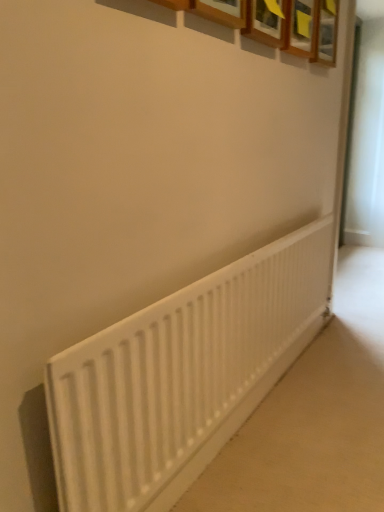
Find the location of a particular element. wooden picture frame at upper center, the second picture frame in the front-to-back sequence is located at coordinates (x=326, y=33).

The image size is (384, 512). Find the location of `wooden picture frame at upper center, the second picture frame in the front-to-back sequence`. wooden picture frame at upper center, the second picture frame in the front-to-back sequence is located at coordinates (326, 33).

Is white matte radiator at lower center not inside wooden picture frame at upper center, the 2th picture frame when ordered from left to right?

Indeed, white matte radiator at lower center is completely outside wooden picture frame at upper center, the 2th picture frame when ordered from left to right.

Does white matte radiator at lower center have a lesser height compared to wooden picture frame at upper center, the 2th picture frame when ordered from left to right?

In fact, white matte radiator at lower center may be taller than wooden picture frame at upper center, the 2th picture frame when ordered from left to right.

Considering the points (195, 438) and (334, 10), which point is in front, point (195, 438) or point (334, 10)?

The point (195, 438) is closer.

Is white matte radiator at lower center turned away from wooden picture frame at upper center, which is the first picture frame from right to left?

No, white matte radiator at lower center's orientation is not away from wooden picture frame at upper center, which is the first picture frame from right to left.

Would you say white matte radiator at lower center is a long distance from wooden frame at upper center, the 1th picture frame in the left-to-right sequence?

white matte radiator at lower center is positioned a significant distance from wooden frame at upper center, the 1th picture frame in the left-to-right sequence.

Between white matte radiator at lower center and wooden frame at upper center, which is counted as the second picture frame, starting from the back, which one has smaller width?

Thinner between the two is white matte radiator at lower center.

From the image's perspective, is white matte radiator at lower center below wooden frame at upper center, which is counted as the second picture frame, starting from the back?

Indeed, from the image's perspective, white matte radiator at lower center is shown beneath wooden frame at upper center, which is counted as the second picture frame, starting from the back.

Is wooden picture frame at upper center, which ranks as the first picture frame in back-to-front order, located within wooden frame at upper center, which is counted as the second picture frame, starting from the back?

That's incorrect, wooden picture frame at upper center, which ranks as the first picture frame in back-to-front order, is not inside wooden frame at upper center, which is counted as the second picture frame, starting from the back.

From the image's perspective, between wooden frame at upper center, which is counted as the second picture frame, starting from the back, and wooden picture frame at upper center, the 2th picture frame when ordered from left to right, who is located below?

wooden frame at upper center, which is counted as the second picture frame, starting from the back, is shown below in the image.

From the picture: From a real-world perspective, is wooden frame at upper center, the 1th picture frame in the left-to-right sequence, on wooden picture frame at upper center, which is the first picture frame from right to left?

No, from a real-world perspective, wooden frame at upper center, the 1th picture frame in the left-to-right sequence, is not above wooden picture frame at upper center, which is the first picture frame from right to left.

From the picture: Which point is more distant from viewer, [304,36] or [331,51]?

The point [331,51] is more distant.

Is wooden picture frame at upper center, which is the first picture frame from right to left, facing towards white matte radiator at lower center?

No, wooden picture frame at upper center, which is the first picture frame from right to left, is not turned towards white matte radiator at lower center.

Is wooden picture frame at upper center, which is the first picture frame from right to left, directly adjacent to white matte radiator at lower center?

They are not placed beside each other.

Considering the relative positions of wooden picture frame at upper center, the second picture frame in the front-to-back sequence, and white matte radiator at lower center in the image provided, is wooden picture frame at upper center, the second picture frame in the front-to-back sequence, in front of white matte radiator at lower center?

No, wooden picture frame at upper center, the second picture frame in the front-to-back sequence, is behind white matte radiator at lower center.

Visually, is wooden picture frame at upper center, the 2th picture frame when ordered from left to right, positioned to the left or to the right of white matte radiator at lower center?

In the image, wooden picture frame at upper center, the 2th picture frame when ordered from left to right, appears on the right side of white matte radiator at lower center.

Looking at this image, is wooden frame at upper center, positioned as the 1th picture frame in front-to-back order, to the left of white matte radiator at lower center from the viewer's perspective?

Incorrect, wooden frame at upper center, positioned as the 1th picture frame in front-to-back order, is not on the left side of white matte radiator at lower center.

Between wooden frame at upper center, which is counted as the second picture frame, starting from the back, and white matte radiator at lower center, which one has less height?

wooden frame at upper center, which is counted as the second picture frame, starting from the back.

Considering the relative sizes of wooden frame at upper center, which is counted as the second picture frame, starting from the back, and white matte radiator at lower center in the image provided, is wooden frame at upper center, which is counted as the second picture frame, starting from the back, thinner than white matte radiator at lower center?

Incorrect, the width of wooden frame at upper center, which is counted as the second picture frame, starting from the back, is not less than that of white matte radiator at lower center.

From a real-world perspective, which is physically below, wooden frame at upper center, positioned as the 1th picture frame in front-to-back order, or white matte radiator at lower center?

white matte radiator at lower center is physically lower.

Considering the sizes of wooden picture frame at upper center, the 2th picture frame when ordered from left to right, and wooden frame at upper center, which is counted as the second picture frame, starting from the back, in the image, is wooden picture frame at upper center, the 2th picture frame when ordered from left to right, bigger or smaller than wooden frame at upper center, which is counted as the second picture frame, starting from the back,?

wooden picture frame at upper center, the 2th picture frame when ordered from left to right, is bigger than wooden frame at upper center, which is counted as the second picture frame, starting from the back.

Which object is more forward, wooden picture frame at upper center, the second picture frame in the front-to-back sequence, or wooden frame at upper center, which is counted as the second picture frame, starting from the back?

wooden frame at upper center, which is counted as the second picture frame, starting from the back, is closer to the camera.

Locate an element on the screen. This screenshot has width=384, height=512. picture frame that appears below the wooden picture frame at upper center, the second picture frame in the front-to-back sequence (from a real-world perspective) is located at coordinates (299, 28).

Between wooden picture frame at upper center, the 2th picture frame when ordered from left to right, and wooden frame at upper center, the 1th picture frame in the left-to-right sequence, which one has smaller width?

wooden picture frame at upper center, the 2th picture frame when ordered from left to right.

This screenshot has height=512, width=384. I want to click on the 2nd picture frame above the white matte radiator at lower center (from the image's perspective), so click(326, 33).

Identify the location of the 1st picture frame behind the white matte radiator at lower center, starting your count from the anchor. [x=299, y=28].

From the image, which object appears to be nearer to wooden frame at upper center, which is counted as the second picture frame, starting from the back, wooden picture frame at upper center, the 2th picture frame when ordered from left to right, or white matte radiator at lower center?

wooden picture frame at upper center, the 2th picture frame when ordered from left to right, lies closer to wooden frame at upper center, which is counted as the second picture frame, starting from the back, than the other object.

From the image, which object appears to be nearer to white matte radiator at lower center, wooden frame at upper center, which is counted as the second picture frame, starting from the back, or wooden picture frame at upper center, the second picture frame in the front-to-back sequence?

wooden frame at upper center, which is counted as the second picture frame, starting from the back, is closer to white matte radiator at lower center.

When comparing their distances from wooden frame at upper center, positioned as the 1th picture frame in front-to-back order, does white matte radiator at lower center or wooden picture frame at upper center, which ranks as the first picture frame in back-to-front order, seem further?

white matte radiator at lower center lies further to wooden frame at upper center, positioned as the 1th picture frame in front-to-back order, than the other object.

Considering their positions, is wooden frame at upper center, the 1th picture frame in the left-to-right sequence, positioned closer to wooden picture frame at upper center, which ranks as the first picture frame in back-to-front order, than white matte radiator at lower center?

Based on the image, wooden frame at upper center, the 1th picture frame in the left-to-right sequence, appears to be nearer to wooden picture frame at upper center, which ranks as the first picture frame in back-to-front order.

Estimate the real-world distances between objects in this image. Which object is further from white matte radiator at lower center, wooden picture frame at upper center, which ranks as the first picture frame in back-to-front order, or wooden frame at upper center, which is counted as the second picture frame, starting from the back?

Among the two, wooden picture frame at upper center, which ranks as the first picture frame in back-to-front order, is located further to white matte radiator at lower center.

Based on their spatial positions, is white matte radiator at lower center or wooden frame at upper center, positioned as the 1th picture frame in front-to-back order, further from wooden picture frame at upper center, which is the first picture frame from right to left?

Based on the image, white matte radiator at lower center appears to be further to wooden picture frame at upper center, which is the first picture frame from right to left.

This screenshot has height=512, width=384. Find the location of `picture frame between wooden picture frame at upper center, the 2th picture frame when ordered from left to right, and white matte radiator at lower center, in the vertical direction`. picture frame between wooden picture frame at upper center, the 2th picture frame when ordered from left to right, and white matte radiator at lower center, in the vertical direction is located at coordinates (299, 28).